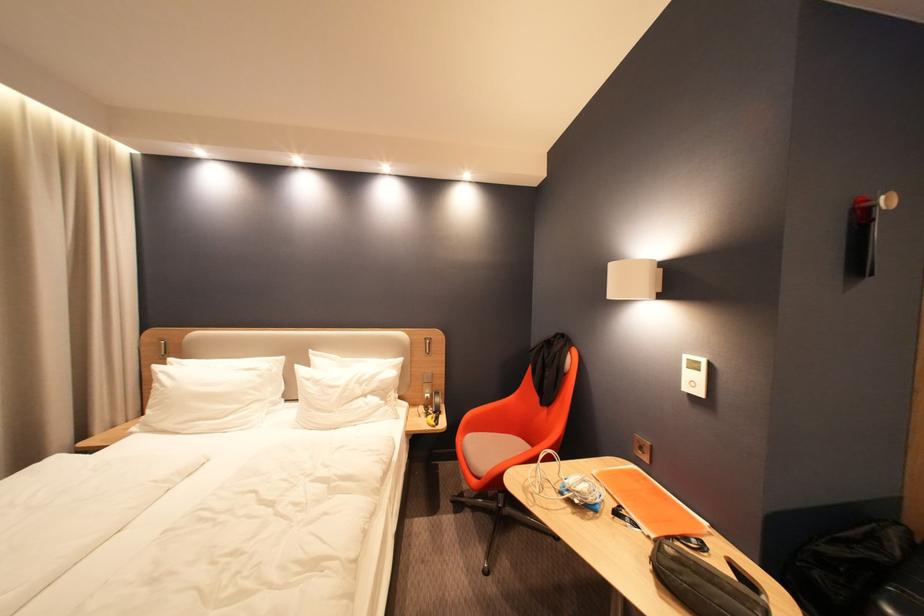
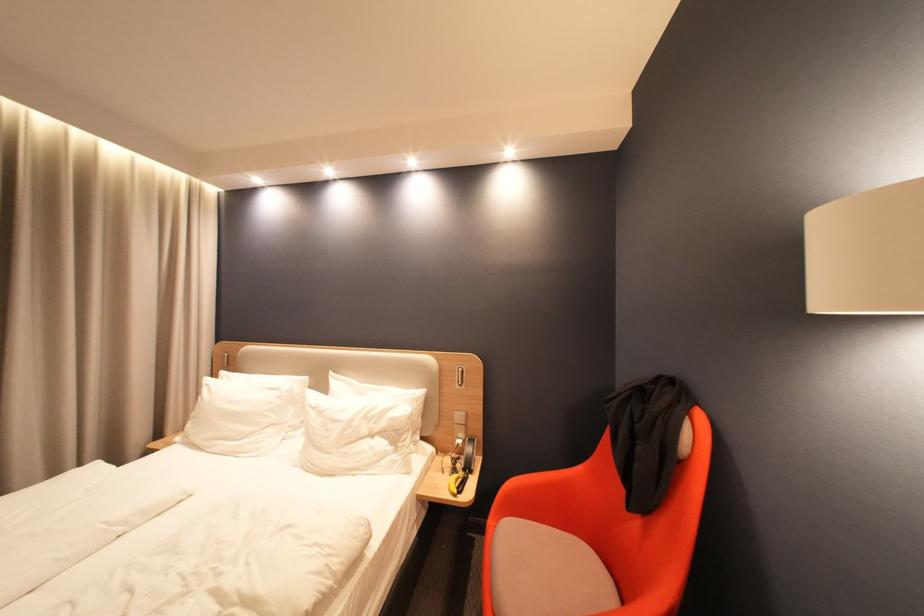
Question: The camera is either moving clockwise (left) or counter-clockwise (right) around the object. The first image is from the beginning of the video and the second image is from the end. Is the camera moving left or right when shooting the video?

Choices:
 (A) Left
 (B) Right

Answer: (B)